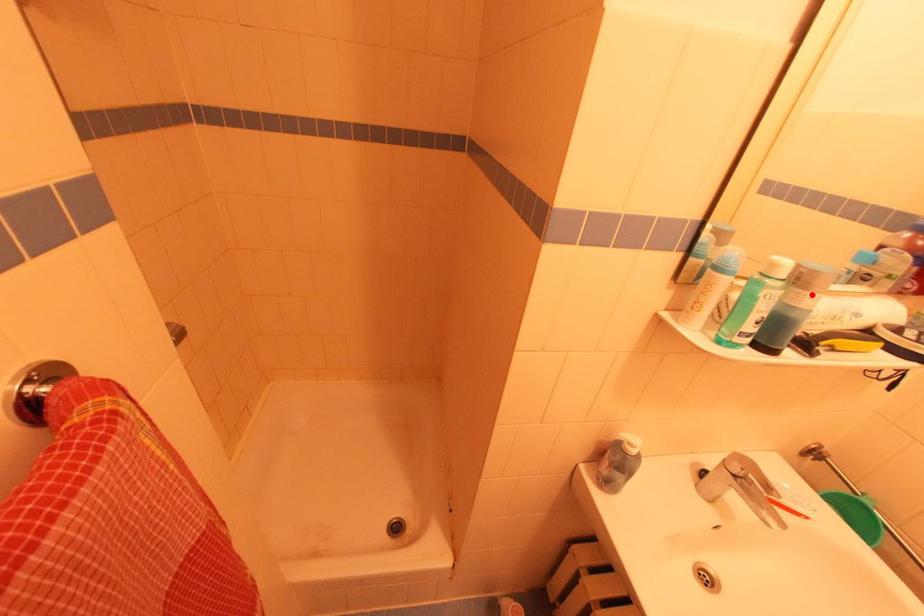
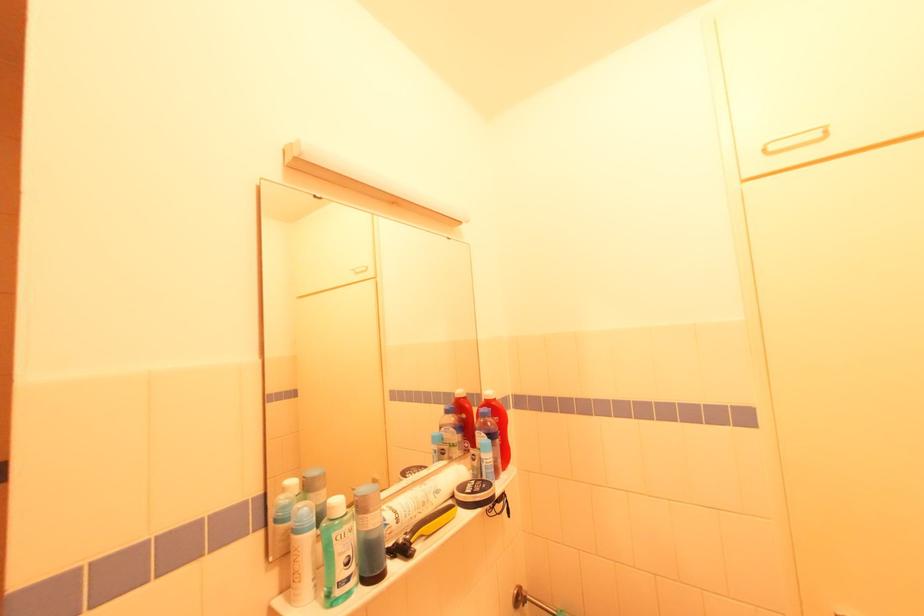
The point at the highlighted location is marked in the first image. Where is the corresponding point in the second image?

(371, 517)